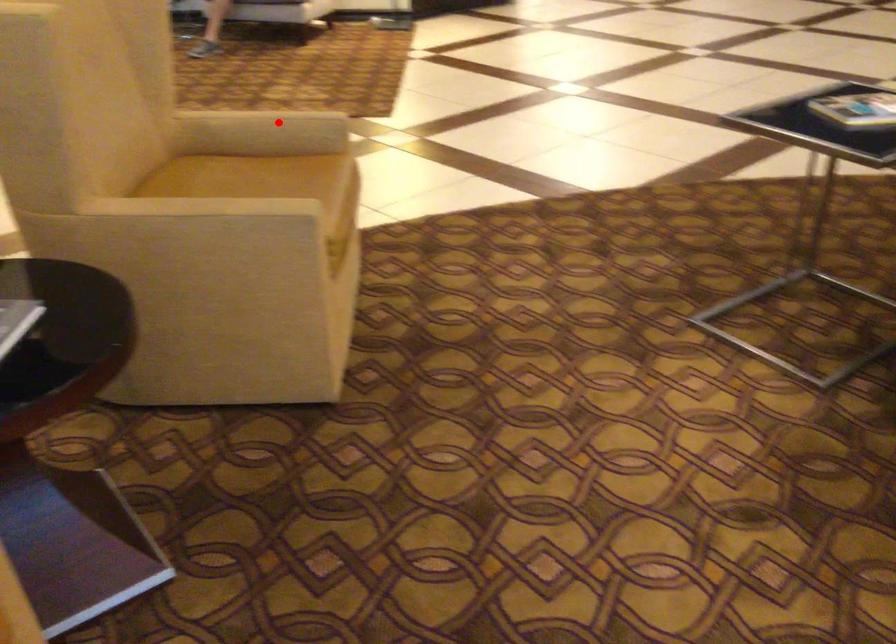
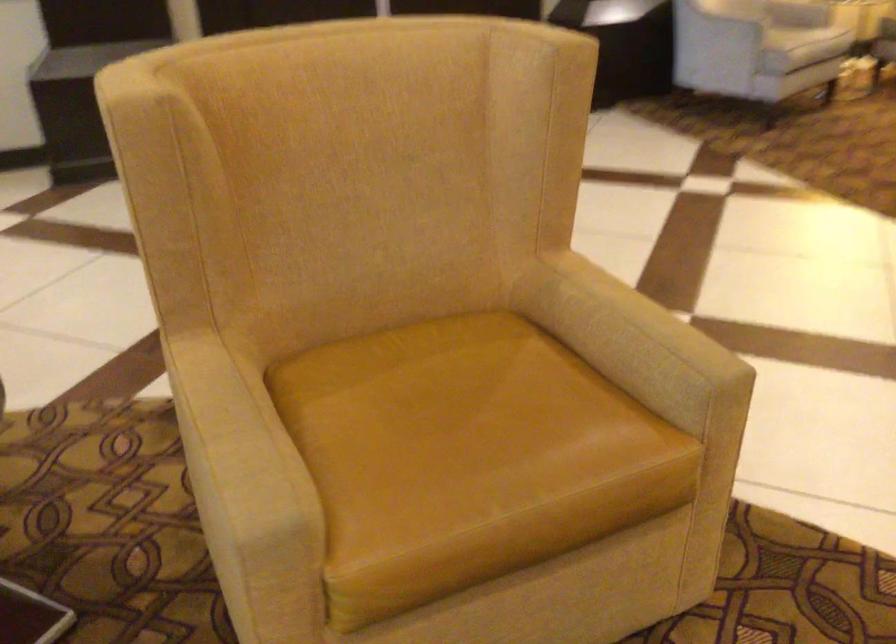
Question: I am providing you with two images of the same scene from different viewpoints. A red point is shown in image1. For the corresponding object point in image2, is it positioned nearer or farther from the camera?

Choices:
 (A) Nearer
 (B) Farther

Answer: (A)